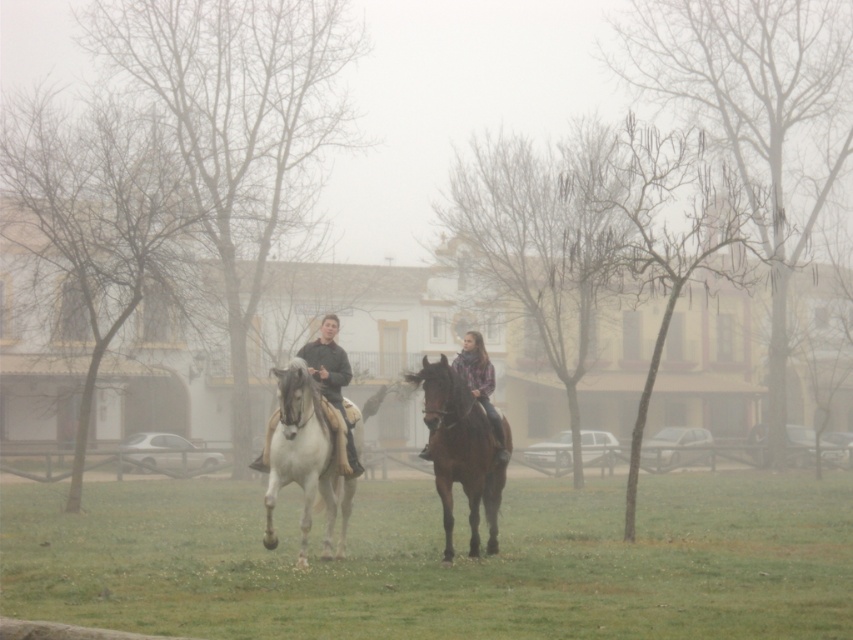
Does white glossy horse at center appear over plaid fabric shirt at center?

Actually, white glossy horse at center is below plaid fabric shirt at center.

Does white glossy horse at center have a greater height compared to plaid fabric shirt at center?

Yes, white glossy horse at center is taller than plaid fabric shirt at center.

Is point (328, 500) closer to viewer compared to point (460, 358)?

Yes, it is in front of point (460, 358).

Identify the location of white glossy horse at center. (305, 460).

Between green grass at center and brown glossy horse at center, which one is positioned lower?

green grass at center is lower down.

Can you confirm if green grass at center is thinner than brown glossy horse at center?

No, green grass at center is not thinner than brown glossy horse at center.

What do you see at coordinates (439, 561) in the screenshot?
I see `green grass at center` at bounding box center [439, 561].

You are a GUI agent. You are given a task and a screenshot of the screen. Output one action in this format:
    pyautogui.click(x=<x>, y=<y>)
    Task: Click on the green grass at center
    
    Given the screenshot: What is the action you would take?
    pyautogui.click(x=439, y=561)

Is dark green leather jacket at center positioned at the back of plaid fabric shirt at center?

No, dark green leather jacket at center is in front of plaid fabric shirt at center.

At what (x,y) coordinates should I click in order to perform the action: click on dark green leather jacket at center. Please return your answer as a coordinate pair (x, y). Looking at the image, I should click on (328, 362).

Does point (312, 352) come in front of point (498, 451)?

No, (312, 352) is further to viewer.

At what (x,y) coordinates should I click in order to perform the action: click on dark green leather jacket at center. Please return your answer as a coordinate pair (x, y). This screenshot has height=640, width=853. Looking at the image, I should click on (328, 362).